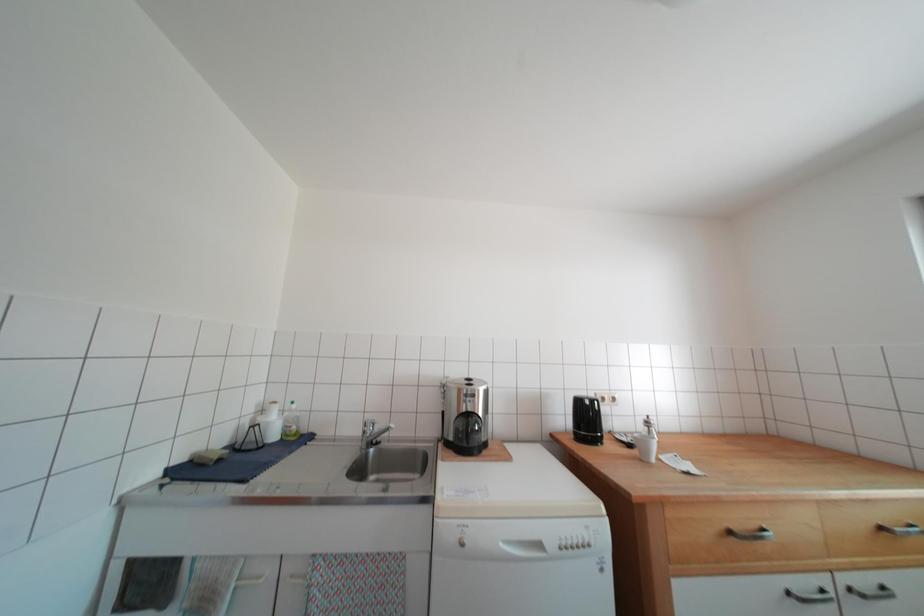
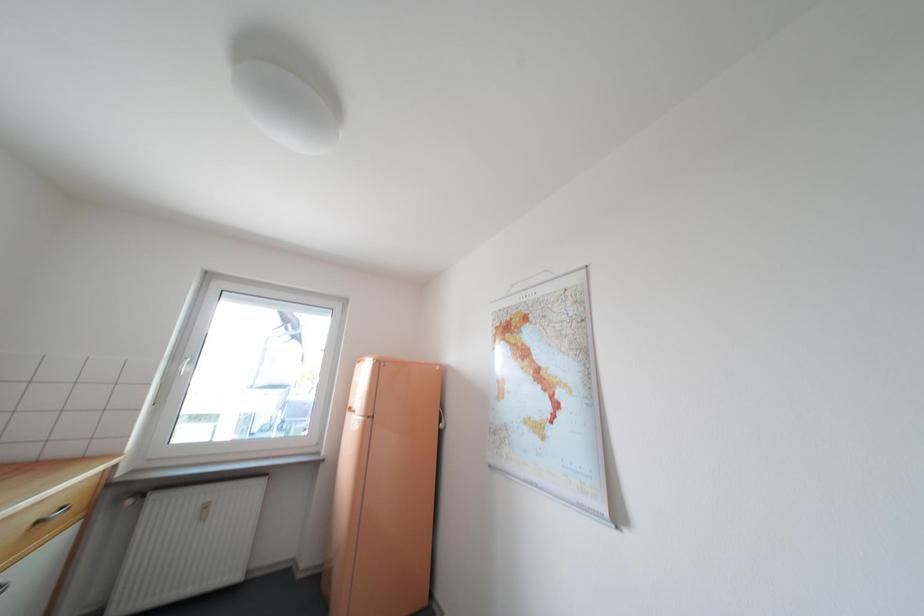
The first image is from the beginning of the video and the second image is from the end. How did the camera likely rotate when shooting the video?

The rotation direction of the camera is right-up.